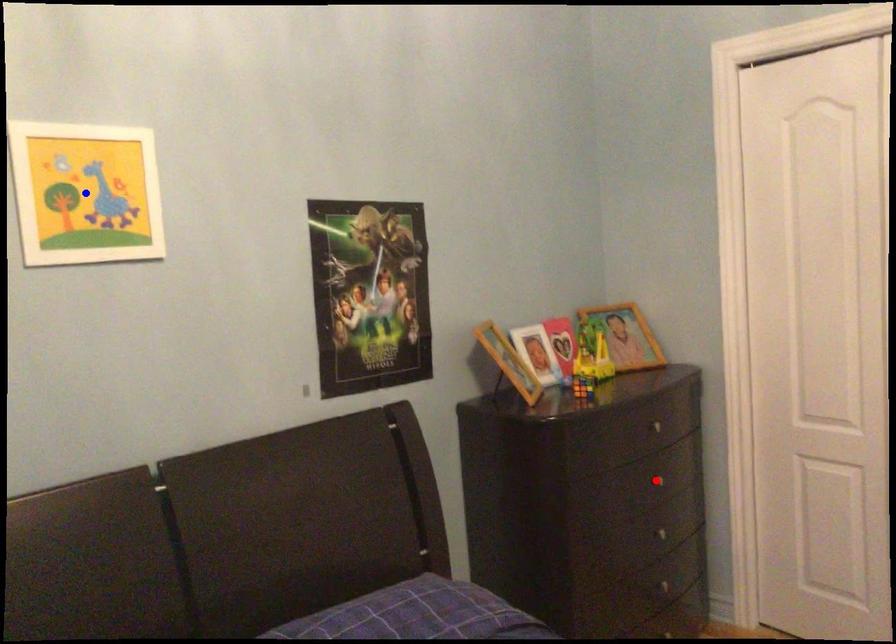
Question: Which of the two points in the image is closer to the camera?

Choices:
 (A) Blue point is closer.
 (B) Red point is closer.

Answer: (A)